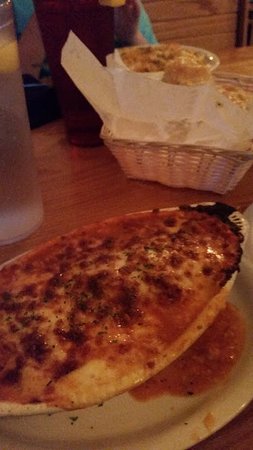
This screenshot has height=450, width=253. I want to click on table, so click(81, 181).